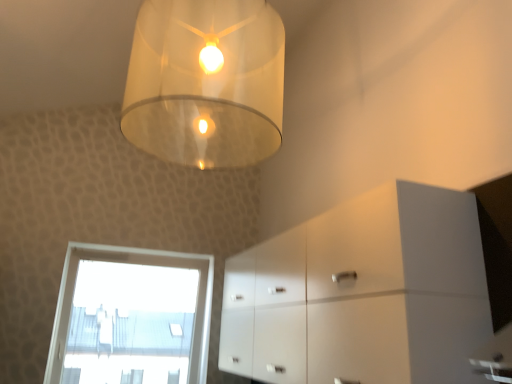
I want to click on transparent glass window at lower left, so click(131, 317).

The image size is (512, 384). What do you see at coordinates (362, 294) in the screenshot?
I see `white glossy cabinet at lower right` at bounding box center [362, 294].

Where is `translucent glass lampshade at upper center`? This screenshot has height=384, width=512. translucent glass lampshade at upper center is located at coordinates (206, 82).

Looking at this image, looking at the image, does transparent glass window at lower left seem bigger or smaller compared to translucent glass lampshade at upper center?

Clearly, transparent glass window at lower left is smaller in size than translucent glass lampshade at upper center.

Is transparent glass window at lower left positioned beyond the bounds of translucent glass lampshade at upper center?

Yes, transparent glass window at lower left is located beyond the bounds of translucent glass lampshade at upper center.

Which is less distant, (66, 279) or (241, 29)?

Point (66, 279) is positioned farther from the camera compared to point (241, 29).

Image resolution: width=512 pixels, height=384 pixels. I want to click on window behind the translucent glass lampshade at upper center, so click(131, 317).

Would you say translucent glass lampshade at upper center is inside or outside transparent glass window at lower left?

translucent glass lampshade at upper center lies outside transparent glass window at lower left.

Is translucent glass lampshade at upper center in front of or behind transparent glass window at lower left in the image?

translucent glass lampshade at upper center is in front of transparent glass window at lower left.

From the image's perspective, relative to transparent glass window at lower left, is translucent glass lampshade at upper center above or below?

From the image's perspective, translucent glass lampshade at upper center appears above transparent glass window at lower left.

Which point is more forward, (281,52) or (276,297)?

The point (281,52) is closer to the camera.

Would you say translucent glass lampshade at upper center is outside white glossy cabinet at lower right?

translucent glass lampshade at upper center lies outside white glossy cabinet at lower right's area.

Which is more to the left, translucent glass lampshade at upper center or white glossy cabinet at lower right?

Positioned to the left is translucent glass lampshade at upper center.

Between translucent glass lampshade at upper center and white glossy cabinet at lower right, which one has less height?

Standing shorter between the two is white glossy cabinet at lower right.

Does point (265, 288) come in front of point (136, 292)?

Yes, point (265, 288) is in front of point (136, 292).

Considering the sizes of objects white glossy cabinet at lower right and transparent glass window at lower left in the image provided, who is taller, white glossy cabinet at lower right or transparent glass window at lower left?

With more height is transparent glass window at lower left.

Image resolution: width=512 pixels, height=384 pixels. I want to click on window on the left of white glossy cabinet at lower right, so click(x=131, y=317).

Which object is thinner, white glossy cabinet at lower right or transparent glass window at lower left?

With smaller width is transparent glass window at lower left.

Is white glossy cabinet at lower right taller than translucent glass lampshade at upper center?

In fact, white glossy cabinet at lower right may be shorter than translucent glass lampshade at upper center.

Looking at the image, does white glossy cabinet at lower right seem bigger or smaller compared to translucent glass lampshade at upper center?

In the image, white glossy cabinet at lower right appears to be larger than translucent glass lampshade at upper center.

From the image's perspective, is white glossy cabinet at lower right on translucent glass lampshade at upper center?

No, from the image's perspective, white glossy cabinet at lower right is not on top of translucent glass lampshade at upper center.

Considering the relative sizes of transparent glass window at lower left and white glossy cabinet at lower right in the image provided, is transparent glass window at lower left smaller than white glossy cabinet at lower right?

Indeed, transparent glass window at lower left has a smaller size compared to white glossy cabinet at lower right.

Is point (104, 352) less distant than point (480, 341)?

No, (104, 352) is further to viewer.

Considering the sizes of objects transparent glass window at lower left and white glossy cabinet at lower right in the image provided, who is thinner, transparent glass window at lower left or white glossy cabinet at lower right?

transparent glass window at lower left.

Is transparent glass window at lower left oriented away from white glossy cabinet at lower right?

No, transparent glass window at lower left is not facing away from white glossy cabinet at lower right.

Identify the location of lamp above the transparent glass window at lower left (from the image's perspective). (206, 82).

Identify the location of lamp on the right side of transparent glass window at lower left. (206, 82).

Looking at the image, which one is located further to transparent glass window at lower left, translucent glass lampshade at upper center or white glossy cabinet at lower right?

translucent glass lampshade at upper center.

Estimate the real-world distances between objects in this image. Which object is closer to translucent glass lampshade at upper center, white glossy cabinet at lower right or transparent glass window at lower left?

Among the two, white glossy cabinet at lower right is located nearer to translucent glass lampshade at upper center.

When comparing their distances from white glossy cabinet at lower right, does transparent glass window at lower left or translucent glass lampshade at upper center seem further?

transparent glass window at lower left is further to white glossy cabinet at lower right.

Looking at the image, which one is located closer to transparent glass window at lower left, white glossy cabinet at lower right or translucent glass lampshade at upper center?

white glossy cabinet at lower right lies closer to transparent glass window at lower left than the other object.

Which object lies nearer to the anchor point translucent glass lampshade at upper center, transparent glass window at lower left or white glossy cabinet at lower right?

Based on the image, white glossy cabinet at lower right appears to be nearer to translucent glass lampshade at upper center.

Based on their spatial positions, is translucent glass lampshade at upper center or transparent glass window at lower left further from white glossy cabinet at lower right?

The object further to white glossy cabinet at lower right is transparent glass window at lower left.

Where is `dresser located between translucent glass lampshade at upper center and transparent glass window at lower left in the depth direction`? This screenshot has width=512, height=384. dresser located between translucent glass lampshade at upper center and transparent glass window at lower left in the depth direction is located at coordinates (362, 294).